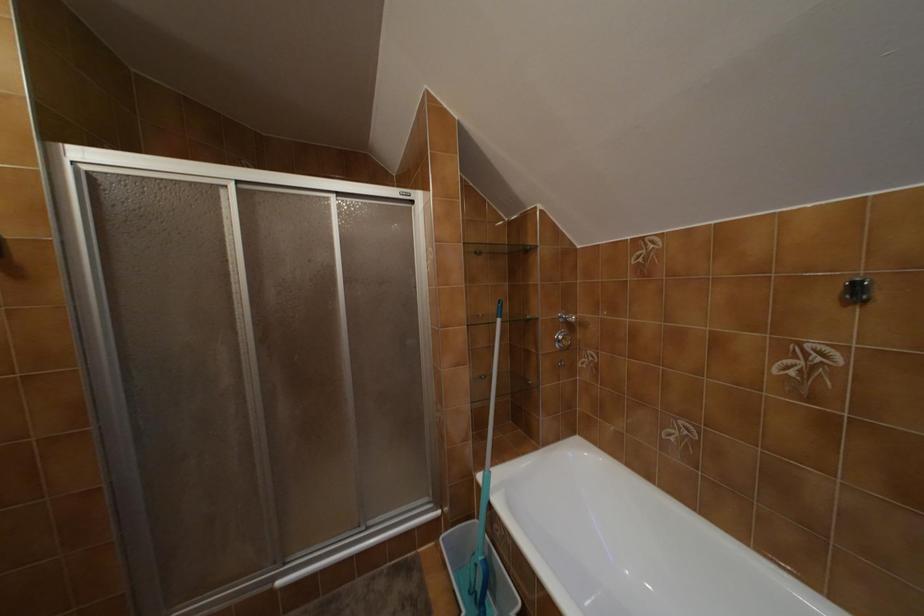
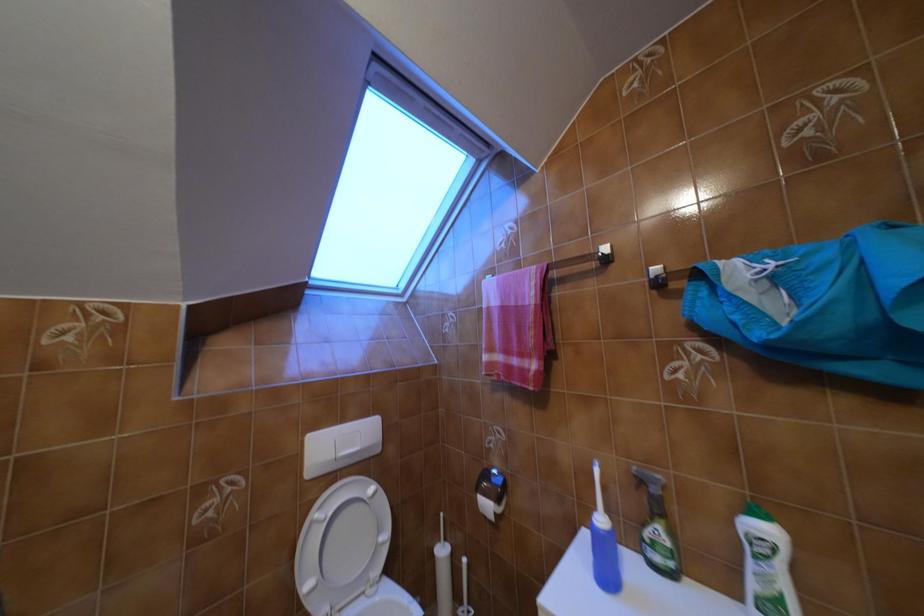
Question: The images are taken continuously from a first-person perspective. In which direction is your viewpoint rotating?

Choices:
 (A) Left
 (B) Right
 (C) Up
 (D) Down

Answer: (B)